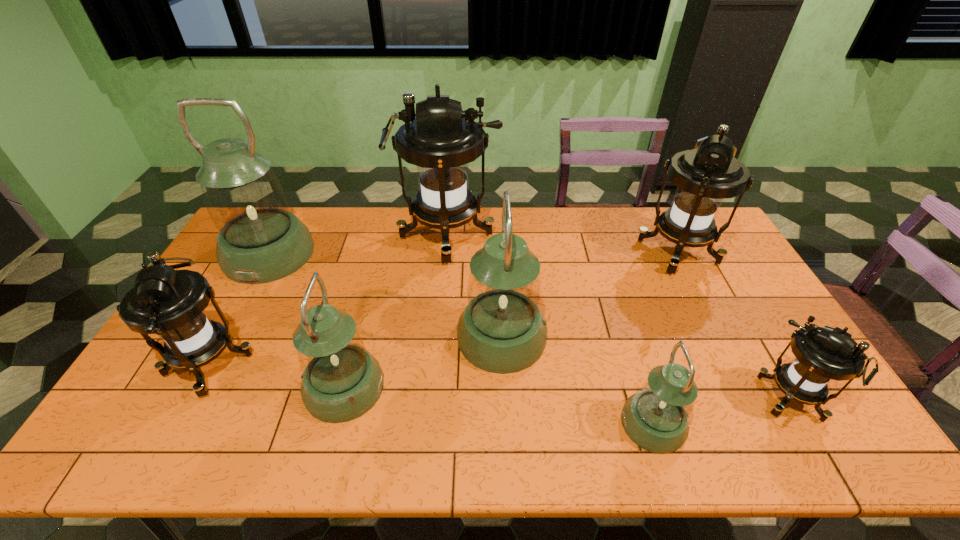
Identify the location of the biggest greenish lantern. (259, 241).

Image resolution: width=960 pixels, height=540 pixels. Identify the location of the farthest greenish lantern. (259, 241).

Find the location of a particular element. The width and height of the screenshot is (960, 540). the biggest black lantern is located at coordinates (442, 139).

I want to click on the third smallest black lantern, so click(705, 176).

What are the coordinates of `the third smallest greenish lantern` in the screenshot? It's located at (502, 330).

In order to click on the third biggest black lantern in this screenshot , I will do pos(170,303).

Locate an element on the screen. The height and width of the screenshot is (540, 960). the second greenish lantern from left to right is located at coordinates (341, 381).

Identify the location of the smallest black lantern. (822, 354).

Where is `the third object from right to left`? This screenshot has width=960, height=540. the third object from right to left is located at coordinates (656, 418).

Identify the location of the sixth lantern from left to right. Image resolution: width=960 pixels, height=540 pixels. tap(656, 418).